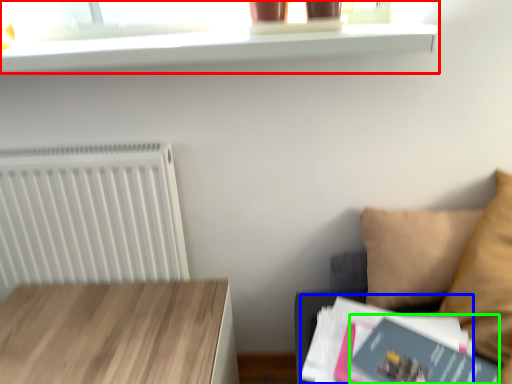
Question: Considering the real-world distances, which object is closest to shelf (highlighted by a red box)? paperback book (highlighted by a blue box) or paperback book (highlighted by a green box).

Choices:
 (A) paperback book
 (B) paperback book

Answer: (A)